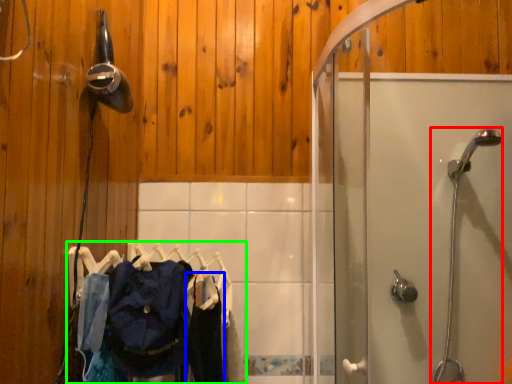
Question: Which object is positioned closest to shower (highlighted by a red box)? Select from clothing (highlighted by a blue box) and laundry (highlighted by a green box).

Choices:
 (A) clothing
 (B) laundry

Answer: (A)